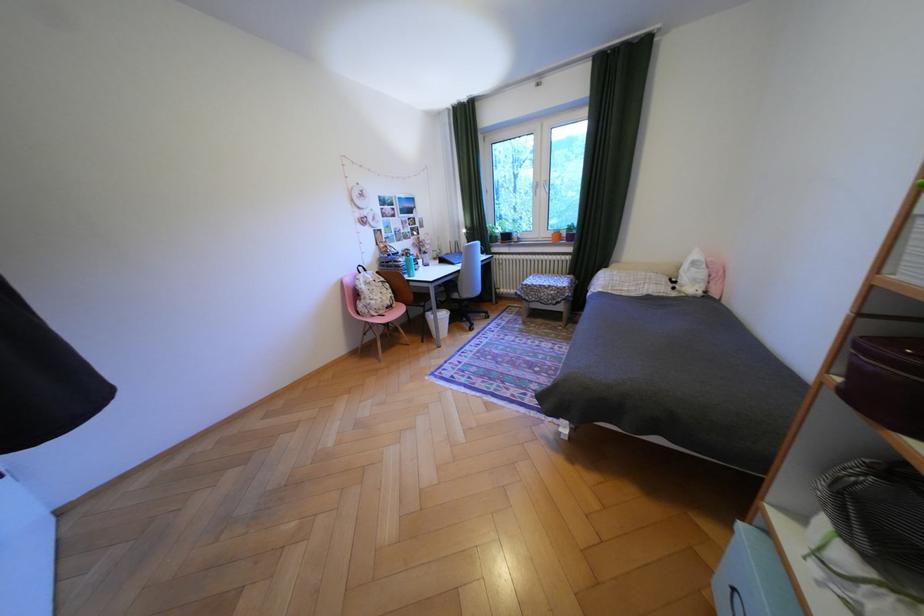
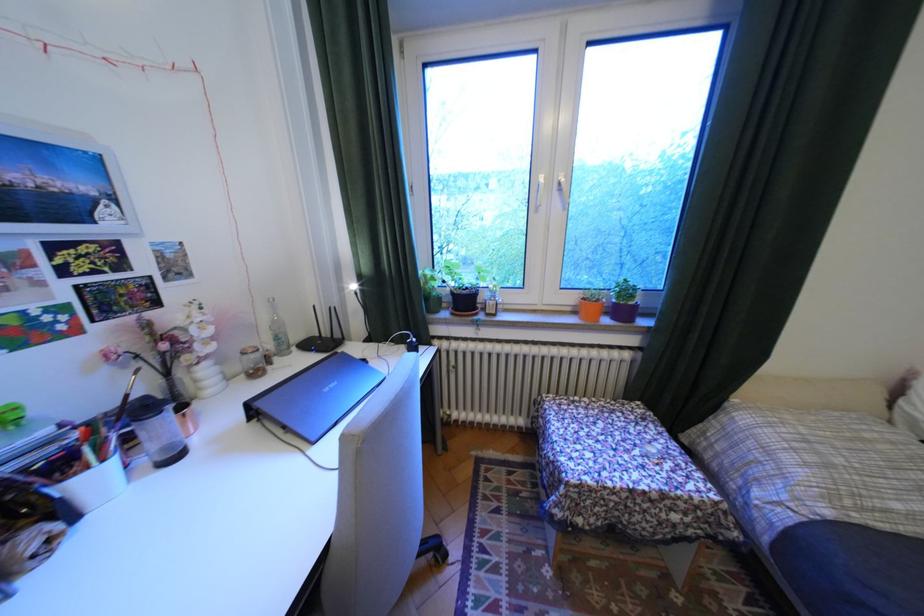
Question: I am providing you with two images of the same scene from different viewpoints. After the viewpoint changes to image2, which objects are now occluded?

Choices:
 (A) white pen holder
 (B) purple flower pot
 (C) glass bottle
 (D) none of these

Answer: (D)